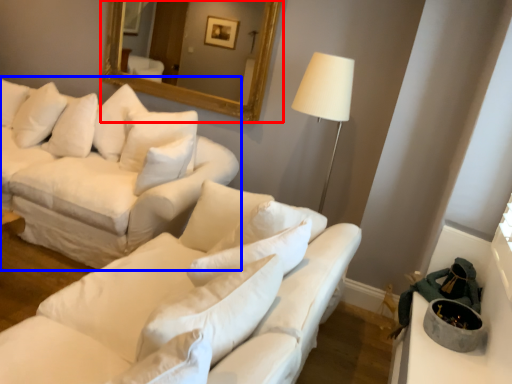
Question: Which object is closer to the camera taking this photo, mirror (highlighted by a red box) or studio couch (highlighted by a blue box)?

Choices:
 (A) mirror
 (B) studio couch

Answer: (B)